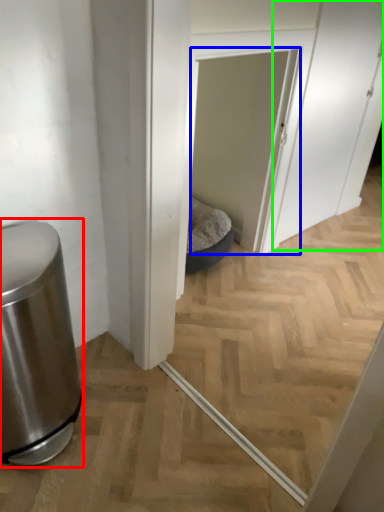
Question: Considering the real-world distances, which object is closest to waste container (highlighted by a red box)? screen door (highlighted by a blue box) or screen door (highlighted by a green box).

Choices:
 (A) screen door
 (B) screen door

Answer: (A)